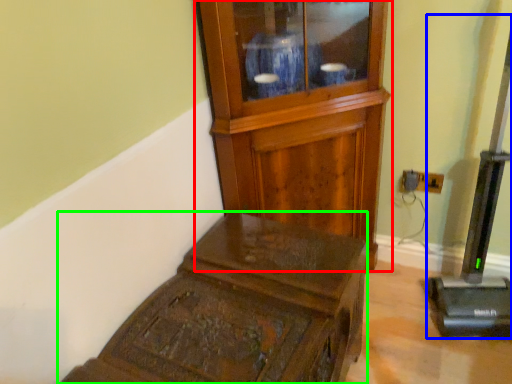
Question: Which object is positioned farthest from side cabinet (highlighted by a red box)? Select from equipment (highlighted by a blue box) and furniture (highlighted by a green box).

Choices:
 (A) equipment
 (B) furniture

Answer: (A)